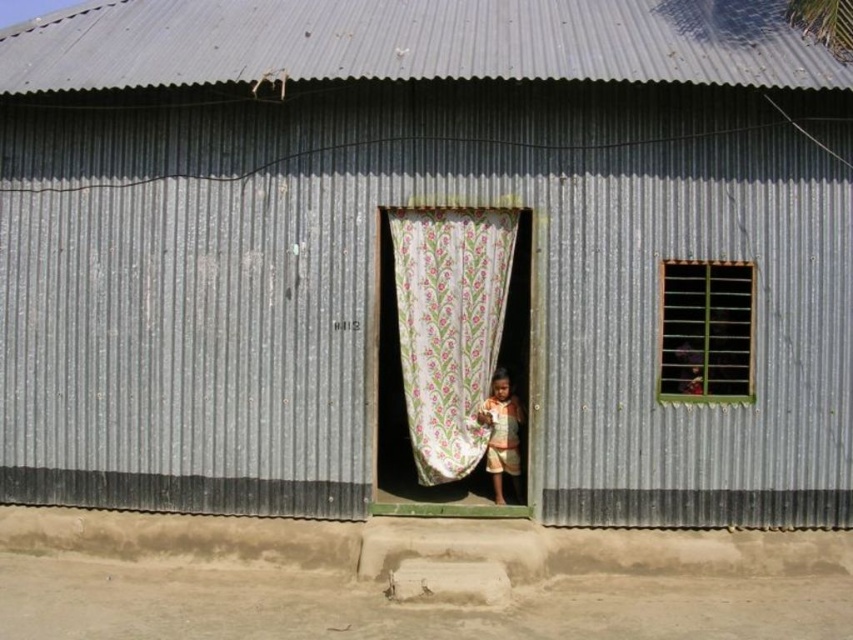
Measure the distance between point (410, 397) and camera.

Point (410, 397) is 34.48 feet away from camera.

Does point (404, 355) come closer to viewer compared to point (737, 332)?

No, (404, 355) is behind (737, 332).

Is point (465, 456) behind point (734, 346)?

Yes, point (465, 456) is behind point (734, 346).

Locate an element on the screen. The height and width of the screenshot is (640, 853). floral-patterned fabric at center is located at coordinates (450, 328).

Consider the image. Does black metal bars at upper right have a greater height compared to light brown fabric at door center?

Indeed, black metal bars at upper right has a greater height compared to light brown fabric at door center.

Can you confirm if black metal bars at upper right is shorter than light brown fabric at door center?

Incorrect, black metal bars at upper right's height does not fall short of light brown fabric at door center's.

The height and width of the screenshot is (640, 853). What do you see at coordinates (706, 330) in the screenshot? I see `black metal bars at upper right` at bounding box center [706, 330].

At what (x,y) coordinates should I click in order to perform the action: click on black metal bars at upper right. Please return your answer as a coordinate pair (x, y). The width and height of the screenshot is (853, 640). Looking at the image, I should click on (706, 330).

Who is lower down, floral-patterned fabric at center or light brown fabric at door center?

light brown fabric at door center

Does floral-patterned fabric at center have a smaller size compared to light brown fabric at door center?

Actually, floral-patterned fabric at center might be larger than light brown fabric at door center.

In the scene shown: Who is more distant from viewer, (x=399, y=316) or (x=515, y=433)?

The point (x=515, y=433) is more distant.

Locate an element on the screen. floral-patterned fabric at center is located at coordinates pos(450,328).